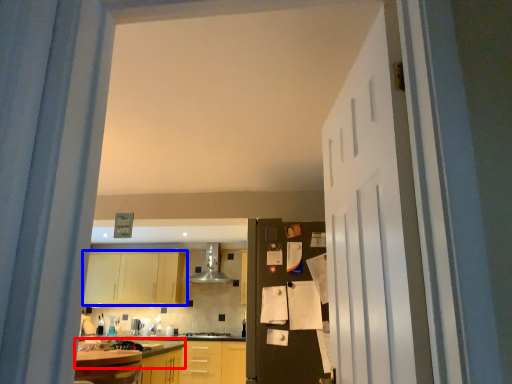
Question: Which object appears closest to the camera in this image, countertop (highlighted by a red box) or cabinetry (highlighted by a blue box)?

Choices:
 (A) countertop
 (B) cabinetry

Answer: (A)